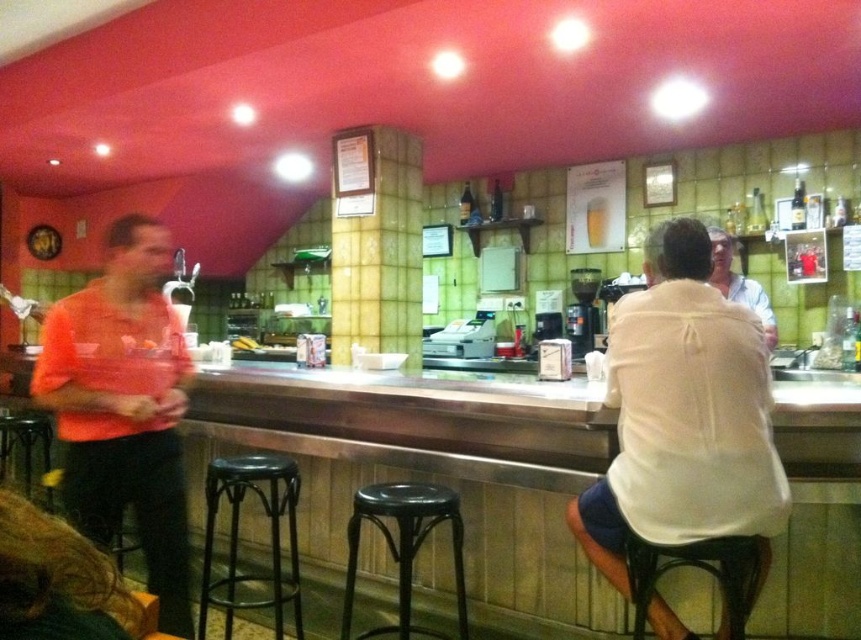
Which is more to the right, white cotton shirt at center or clear glass beer at center?

white cotton shirt at center

Who is shorter, white cotton shirt at center or clear glass beer at center?

clear glass beer at center is shorter.

Does point (725, 262) come behind point (502, 200)?

No, it is in front of (502, 200).

The height and width of the screenshot is (640, 861). What are the coordinates of `white cotton shirt at center` in the screenshot? It's located at (739, 284).

Can you confirm if orange t-shirt at left is thinner than black plastic bar stool at center?

No.

Is point (137, 280) positioned behind point (348, 586)?

Yes, it is behind point (348, 586).

The height and width of the screenshot is (640, 861). What are the coordinates of `orange t-shirt at left` in the screenshot? It's located at (122, 406).

Based on the photo, is white cotton shirt at right wider than white cotton shirt at center?

Yes.

Is white cotton shirt at right smaller than white cotton shirt at center?

Actually, white cotton shirt at right might be larger than white cotton shirt at center.

Which is behind, point (660, 470) or point (717, 252)?

The point (717, 252) is more distant.

Locate an element on the screen. Image resolution: width=861 pixels, height=640 pixels. white cotton shirt at right is located at coordinates (683, 416).